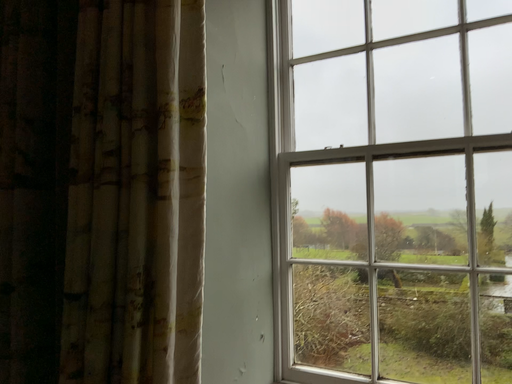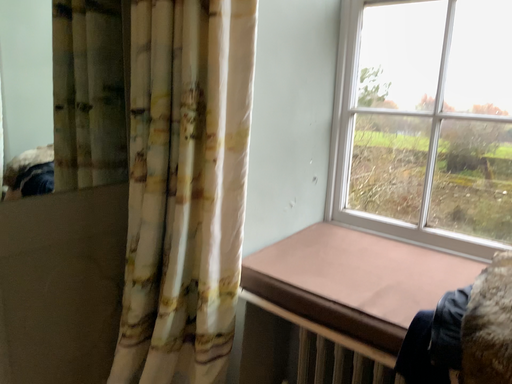
Question: How did the camera likely rotate when shooting the video?

Choices:
 (A) rotated downward
 (B) rotated upward

Answer: (A)